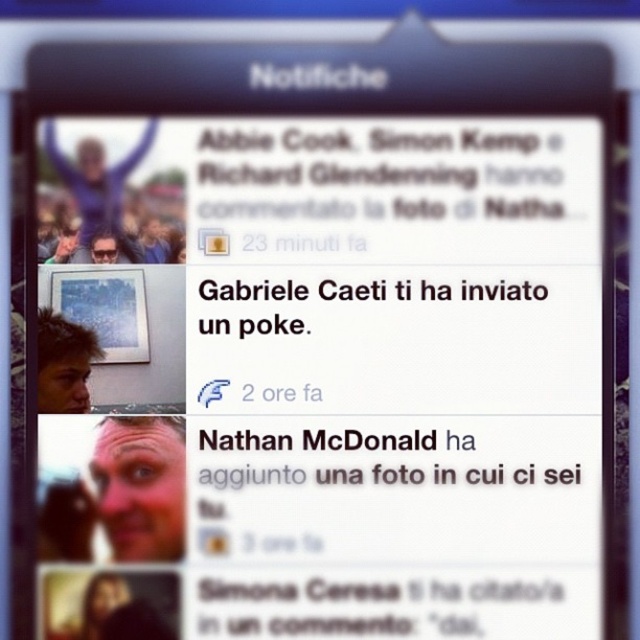
Who is positioned more to the left, blurred skin face at lower left or matte black sunglasses at upper left?

matte black sunglasses at upper left

How distant is blurred skin face at lower left from matte black sunglasses at upper left?

The distance of blurred skin face at lower left from matte black sunglasses at upper left is 6.21 inches.

The width and height of the screenshot is (640, 640). In order to click on blurred skin face at lower left in this screenshot , I will do `click(140, 484)`.

Locate an element on the screen. blurred skin face at lower left is located at coordinates (140, 484).

Is blonde hair at left to the left of matte black sunglasses at upper left from the viewer's perspective?

Yes, blonde hair at left is to the left of matte black sunglasses at upper left.

Find the location of a particular element. The image size is (640, 640). blonde hair at left is located at coordinates (64, 364).

Identify the location of blonde hair at left. This screenshot has width=640, height=640. (64, 364).

How distant is blurred skin face at lower left from blonde hair at left?

A distance of 2.71 inches exists between blurred skin face at lower left and blonde hair at left.

Image resolution: width=640 pixels, height=640 pixels. In order to click on blurred skin face at lower left in this screenshot , I will do `click(140, 484)`.